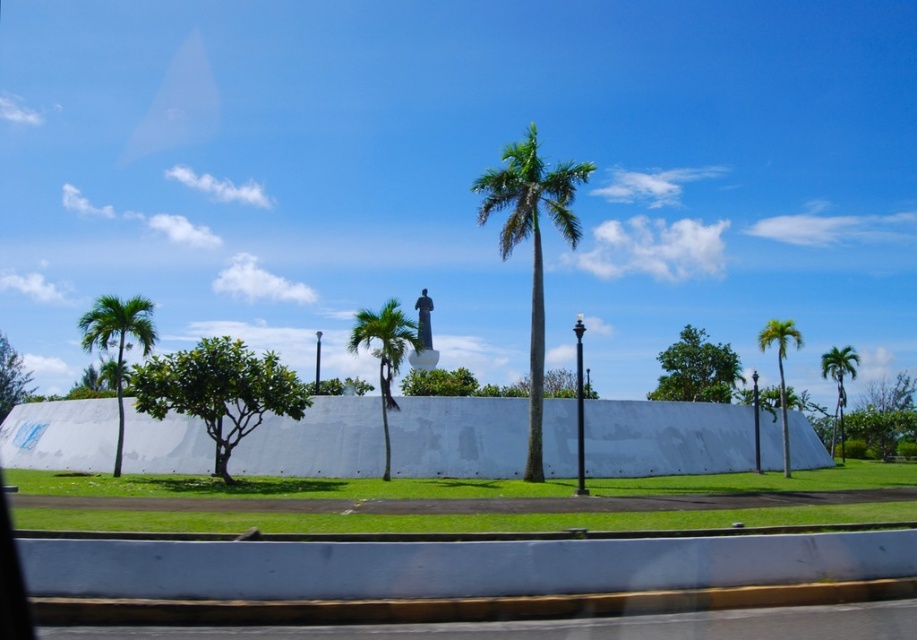
Between green leafy palm at center and green leafy palm tree at right, which one has more height?

With more height is green leafy palm at center.

Who is lower down, green leafy palm at center or green leafy palm tree at right?

Positioned lower is green leafy palm tree at right.

Between point (503, 221) and point (831, 438), which one is positioned in front?

Point (503, 221)

Where is `green leafy palm at center`? The image size is (917, 640). green leafy palm at center is located at coordinates (531, 244).

Is green leafy palm at center taller than green leafy palm tree at center?

Yes.

Measure the distance between point (503, 179) and camera.

The distance of point (503, 179) from camera is 76.92 feet.

Who is more forward, (577,173) or (391,308)?

Point (391,308) is in front.

This screenshot has height=640, width=917. In order to click on green leafy palm at center in this screenshot , I will do `click(531, 244)`.

Is green leafy palm at center bigger than green leafy palm tree at center-right?

Indeed, green leafy palm at center has a larger size compared to green leafy palm tree at center-right.

Does green leafy palm at center appear over green leafy palm tree at center-right?

Yes.

I want to click on green leafy palm at center, so coord(531,244).

Image resolution: width=917 pixels, height=640 pixels. I want to click on green leafy palm at center, so click(x=531, y=244).